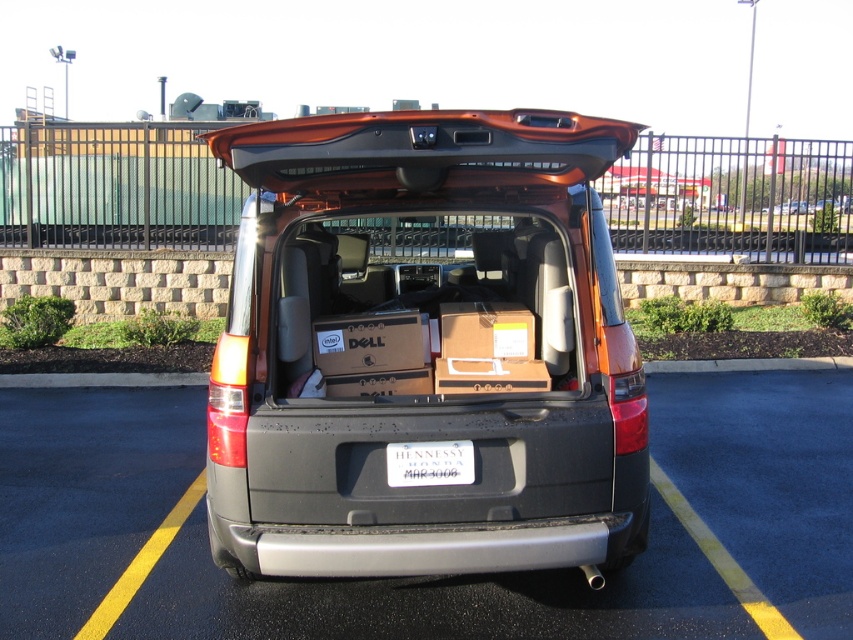
Question: Which of the following is the closest to the observer?

Choices:
 (A) (524, 410)
 (B) (444, 476)
 (C) (392, 336)
 (D) (155, 608)

Answer: (B)

Question: Considering the real-world distances, which object is closest to the matte brown cardboard box at center?

Choices:
 (A) metallic orange suv at center
 (B) white plastic license plate at center

Answer: (A)

Question: Is metallic orange suv at center bigger than white plastic license plate at center?

Choices:
 (A) yes
 (B) no

Answer: (A)

Question: Estimate the real-world distances between objects in this image. Which object is closer to the black plastic car at center?

Choices:
 (A) matte brown cardboard box at center
 (B) metallic orange suv at center

Answer: (A)

Question: Does metallic orange suv at center appear on the right side of black plastic car at center?

Choices:
 (A) no
 (B) yes

Answer: (A)

Question: Can you confirm if black plastic car at center is positioned to the left of matte brown cardboard box at center?

Choices:
 (A) yes
 (B) no

Answer: (B)